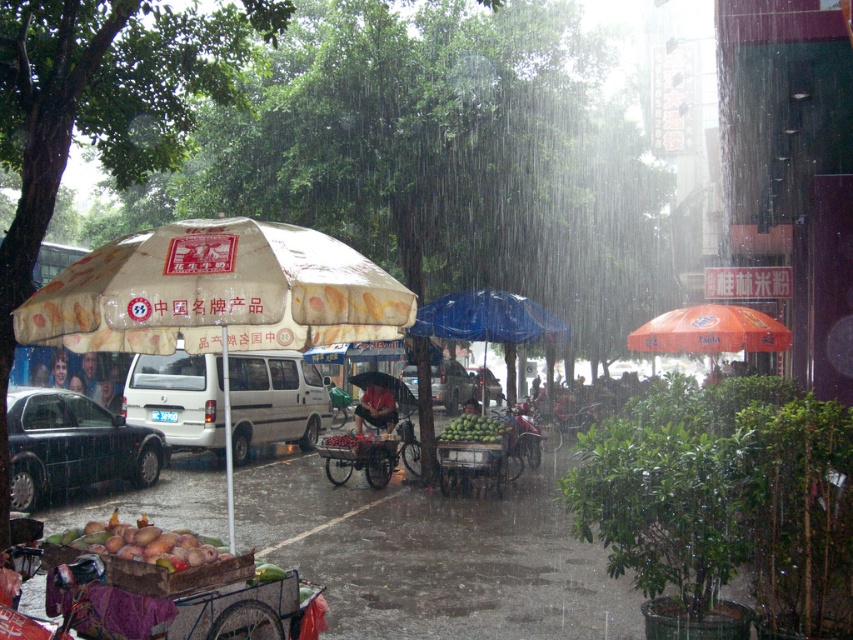
Question: Which point is farther from the camera taking this photo?

Choices:
 (A) (90, 346)
 (B) (498, 320)
 (C) (106, 444)
 (D) (440, 381)

Answer: (D)

Question: Does shiny black sedan at left have a larger size compared to smooth skin face at center?

Choices:
 (A) no
 (B) yes

Answer: (B)

Question: Which is nearer to the blue matte umbrella at center?

Choices:
 (A) green matte mangoes at center
 (B) yellow printed fabric umbrella at center-left

Answer: (A)

Question: Can you confirm if mangoes at lower left is positioned below blonde hair at center?

Choices:
 (A) no
 (B) yes

Answer: (B)

Question: Which is farther from the smooth skin face at center?

Choices:
 (A) mangoes at lower left
 (B) orange fabric umbrella at right
 (C) metallic silver van at center
 (D) shiny black sedan at left

Answer: (A)

Question: Is the position of beige printed umbrella at left less distant than that of yellow printed fabric umbrella at center-left?

Choices:
 (A) yes
 (B) no

Answer: (B)